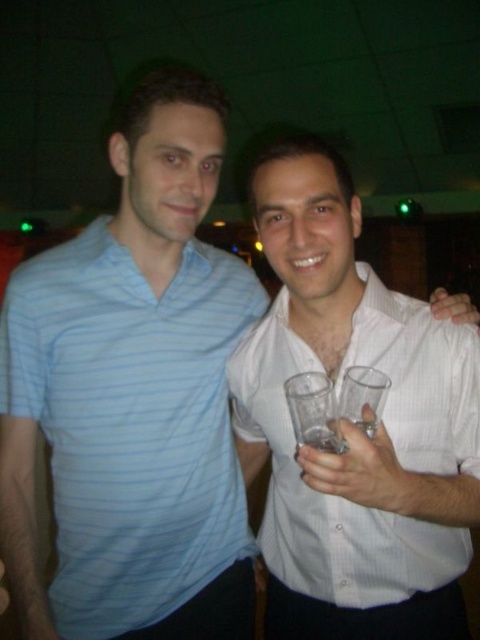
Question: Which is farther from the white textured shirt at center?

Choices:
 (A) clear plastic glass at center
 (B) light blue striped polo at left

Answer: (A)

Question: Is light blue striped polo at left positioned in front of clear plastic glass at center?

Choices:
 (A) yes
 (B) no

Answer: (B)

Question: Among these objects, which one is farthest from the camera?

Choices:
 (A) white matte hand at upper right
 (B) clear plastic glass at center

Answer: (A)

Question: Can you confirm if white matte hand at upper right is positioned above clear plastic glass at center?

Choices:
 (A) no
 (B) yes

Answer: (B)

Question: Is the position of white matte hand at upper right more distant than that of clear plastic glass at center?

Choices:
 (A) no
 (B) yes

Answer: (B)

Question: Which object is the closest to the clear glass at center?

Choices:
 (A) white textured shirt at center
 (B) light blue striped polo at left
 (C) clear plastic glass at center
 (D) white matte hand at upper right

Answer: (C)